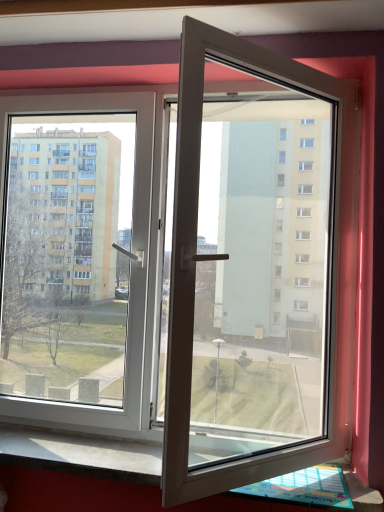
Identify the location of white plastic door at center. (256, 273).

The height and width of the screenshot is (512, 384). What do you see at coordinates (256, 273) in the screenshot?
I see `white plastic door at center` at bounding box center [256, 273].

Based on the photo, measure the distance between point (73, 467) and camera.

5.18 feet.

The height and width of the screenshot is (512, 384). Describe the element at coordinates (81, 455) in the screenshot. I see `black granite window sill at lower center` at that location.

Identify the location of black granite window sill at lower center. This screenshot has height=512, width=384. (81, 455).

At what (x,y) coordinates should I click in order to perform the action: click on white plastic door at center. Please return your answer as a coordinate pair (x, y). Looking at the image, I should click on (256, 273).

Which is more to the left, white plastic door at center or black granite window sill at lower center?

From the viewer's perspective, white plastic door at center appears more on the left side.

Considering the positions of objects white plastic door at center and black granite window sill at lower center in the image provided, who is in front, white plastic door at center or black granite window sill at lower center?

white plastic door at center is more forward.

Does point (232, 120) come closer to viewer compared to point (91, 499)?

No, it is behind (91, 499).

From the image's perspective, between white plastic door at center and black granite window sill at lower center, which one is located above?

white plastic door at center appears higher in the image.

From a real-world perspective, is white plastic door at center under black granite window sill at lower center?

No.

Can you confirm if white plastic door at center is wider than black granite window sill at lower center?

Yes, white plastic door at center is wider than black granite window sill at lower center.

Does white plastic door at center have a greater height compared to black granite window sill at lower center?

Yes, white plastic door at center is taller than black granite window sill at lower center.

Between white plastic door at center and black granite window sill at lower center, which one has smaller size?

black granite window sill at lower center.

Is black granite window sill at lower center completely or partially inside white plastic door at center?

No, black granite window sill at lower center is not inside white plastic door at center.

Is white plastic door at center with black granite window sill at lower center?

No, white plastic door at center is not beside black granite window sill at lower center.

Could you tell me if white plastic door at center is turned towards black granite window sill at lower center?

No.

How many degrees apart are the facing directions of white plastic door at center and black granite window sill at lower center?

The angular difference between white plastic door at center and black granite window sill at lower center is 0.208 degrees.

Measure the distance between white plastic door at center and black granite window sill at lower center.

white plastic door at center is 33.50 inches from black granite window sill at lower center.

The height and width of the screenshot is (512, 384). What are the coordinates of `window sill located on the right of white plastic door at center` in the screenshot? It's located at (81, 455).

In the scene shown: Which is more to the right, black granite window sill at lower center or white plastic door at center?

Positioned to the right is black granite window sill at lower center.

Between black granite window sill at lower center and white plastic door at center, which one is positioned in front?

white plastic door at center.

Which is less distant, (43,434) or (185,101)?

Point (43,434) is positioned farther from the camera compared to point (185,101).

From the image's perspective, is black granite window sill at lower center above white plastic door at center?

No, from the image's perspective, black granite window sill at lower center is not on top of white plastic door at center.

From a real-world perspective, is black granite window sill at lower center beneath white plastic door at center?

Indeed, from a real-world perspective, black granite window sill at lower center is positioned beneath white plastic door at center.

Is black granite window sill at lower center thinner than white plastic door at center?

Yes, black granite window sill at lower center is thinner than white plastic door at center.

Looking at this image, is black granite window sill at lower center taller or shorter than white plastic door at center?

black granite window sill at lower center is shorter than white plastic door at center.

Based on the photo, between black granite window sill at lower center and white plastic door at center, which one has larger size?

With larger size is white plastic door at center.

Is black granite window sill at lower center completely or partially outside of white plastic door at center?

black granite window sill at lower center lies outside white plastic door at center's area.

Are black granite window sill at lower center and white plastic door at center located far from each other?

That's not correct — black granite window sill at lower center is a little close to white plastic door at center.

Does black granite window sill at lower center turn towards white plastic door at center?

No, black granite window sill at lower center is not facing towards white plastic door at center.

How far apart are black granite window sill at lower center and white plastic door at center?

33.50 inches.

In the image, there is a white plastic door at center. Where is `window sill below it (from the image's perspective)`? This screenshot has height=512, width=384. window sill below it (from the image's perspective) is located at coordinates (81, 455).

Find the location of a particular element. door in front of the black granite window sill at lower center is located at coordinates (256, 273).

You are a GUI agent. You are given a task and a screenshot of the screen. Output one action in this format:
    pyautogui.click(x=<x>, y=<y>)
    Task: Click on the door above the black granite window sill at lower center (from the image's perspective)
    The width and height of the screenshot is (384, 512).
    Given the screenshot: What is the action you would take?
    tap(256, 273)